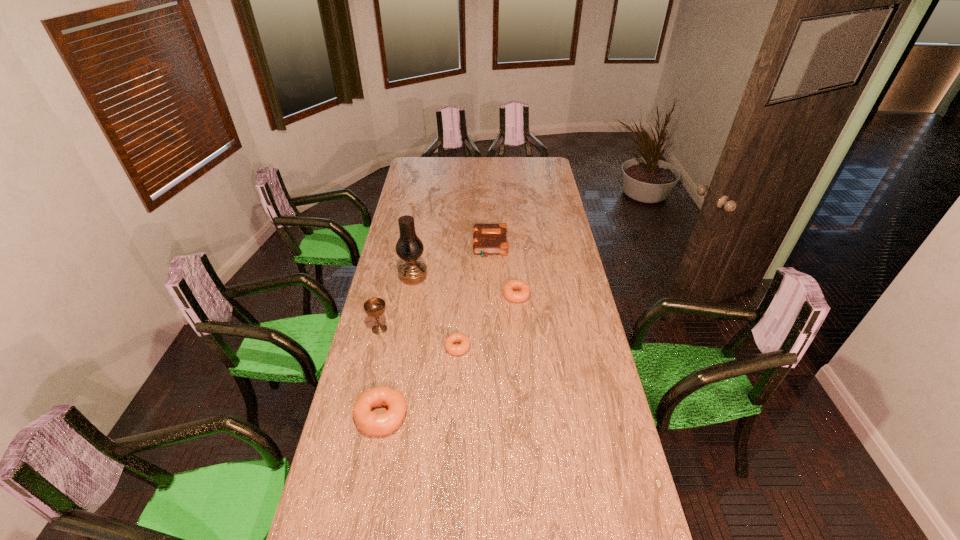
Locate an element on the screen. the tallest doughnut is located at coordinates [367, 421].

What are the coordinates of `the nearest doughnut` in the screenshot? It's located at (367, 421).

This screenshot has width=960, height=540. I want to click on the shortest doughnut, so click(x=452, y=349).

Locate an element on the screen. the fifth farthest object is located at coordinates (452, 349).

Where is `the rightmost doughnut`? This screenshot has height=540, width=960. the rightmost doughnut is located at coordinates (513, 284).

Identify the location of the farthest doughnut. Image resolution: width=960 pixels, height=540 pixels. (513, 284).

At what (x,y) coordinates should I click in order to perform the action: click on the farthest object. Please return your answer as a coordinate pair (x, y). This screenshot has height=540, width=960. Looking at the image, I should click on (487, 238).

What are the coordinates of `the fifth shortest object` in the screenshot? It's located at (374, 307).

This screenshot has height=540, width=960. I want to click on the third nearest object, so click(374, 307).

At what (x,y) coordinates should I click in order to perform the action: click on oil lamp. Please return your answer as a coordinate pair (x, y). Looking at the image, I should click on pos(409,247).